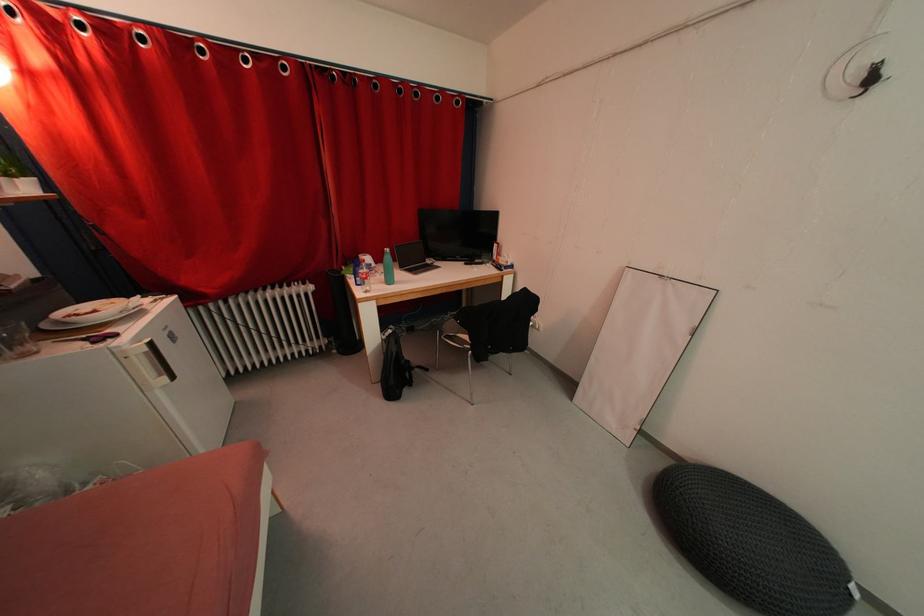
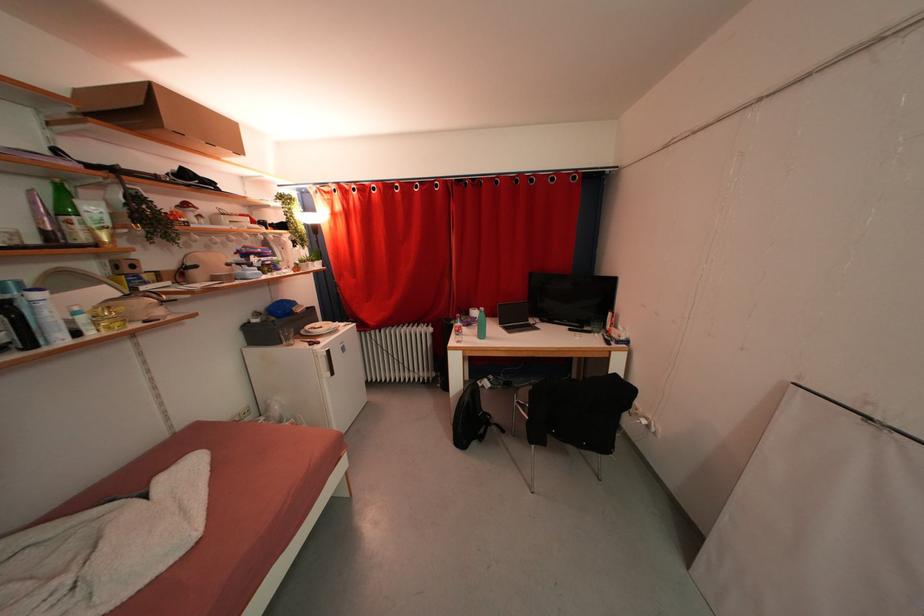
Question: The camera is either moving clockwise (left) or counter-clockwise (right) around the object. The first image is from the beginning of the video and the second image is from the end. Is the camera moving left or right when shooting the video?

Choices:
 (A) Left
 (B) Right

Answer: (B)